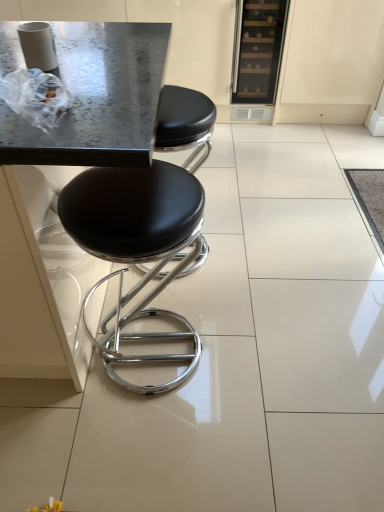
Question: Is black leather stool at center wider or thinner than matte glass wine cooler at upper right?

Choices:
 (A) thin
 (B) wide

Answer: (A)

Question: Is black leather stool at center to the left or to the right of matte glass wine cooler at upper right in the image?

Choices:
 (A) right
 (B) left

Answer: (B)

Question: Estimate the real-world distances between objects in this image. Which object is farther from the metallic gray table at center?

Choices:
 (A) matte glass wine cooler at upper right
 (B) black leather stool at center

Answer: (A)

Question: Which object is positioned closest to the matte glass wine cooler at upper right?

Choices:
 (A) metallic gray table at center
 (B) black leather stool at center

Answer: (B)